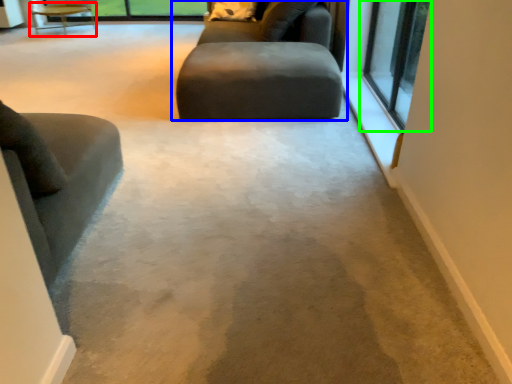
Question: Considering the real-world distances, which object is farthest from table (highlighted by a red box)? studio couch (highlighted by a blue box) or window (highlighted by a green box)?

Choices:
 (A) studio couch
 (B) window

Answer: (B)